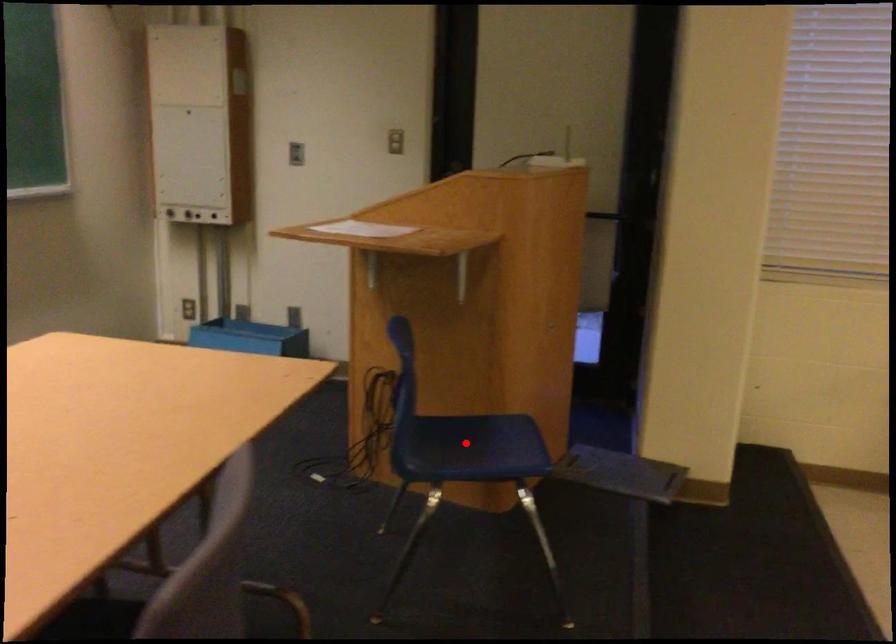
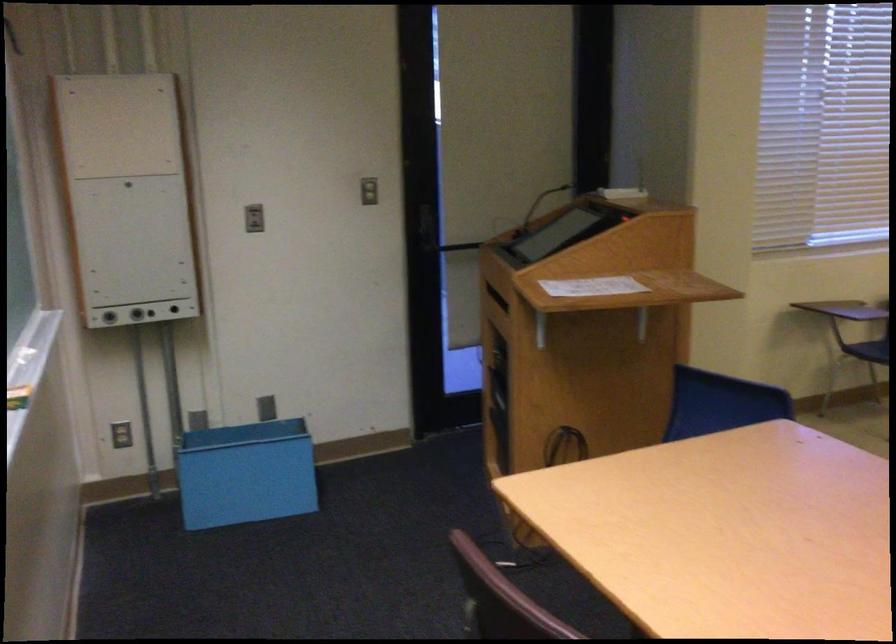
Question: I am providing you with two images of the same scene from different viewpoints. A red point is marked on the first image. Is the red point's position out of view in image 2?

Choices:
 (A) Yes
 (B) No

Answer: (A)